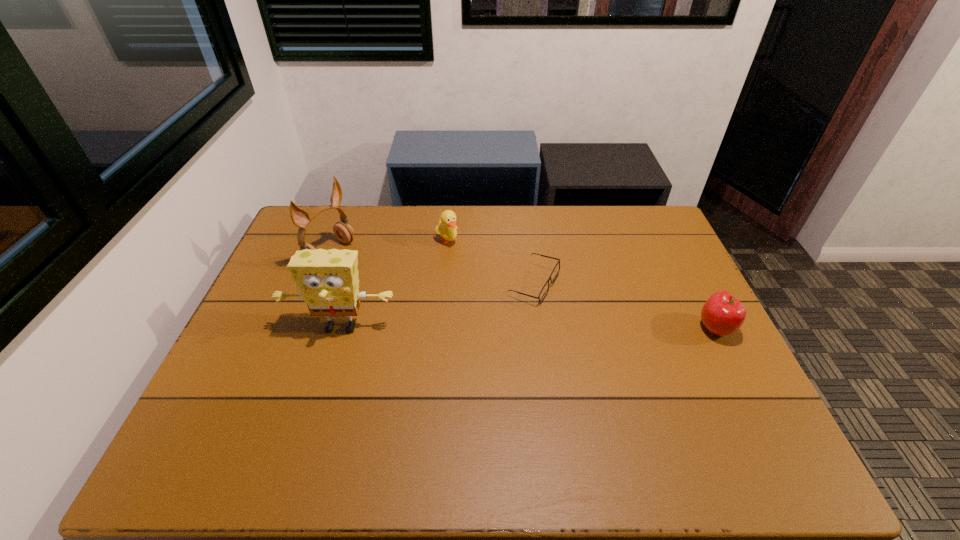
Find the location of a particular element. This screenshot has height=540, width=960. vacant space located 0.180m on the front-facing side of the third object from left to right is located at coordinates 476,282.

Locate an element on the screen. free space located on the front-facing side of the earphone is located at coordinates (399, 292).

Find the location of a particular element. Image resolution: width=960 pixels, height=540 pixels. vacant point located on the front-facing side of the earphone is located at coordinates [399, 292].

Where is `free region located 0.190m on the front-facing side of the earphone`? This screenshot has height=540, width=960. free region located 0.190m on the front-facing side of the earphone is located at coordinates (390, 286).

The height and width of the screenshot is (540, 960). I want to click on free space located with the lenses facing outward on the fourth object from left to right, so click(586, 334).

You are a GUI agent. You are given a task and a screenshot of the screen. Output one action in this format:
    pyautogui.click(x=<x>, y=<y>)
    Task: Click on the free space located 0.240m with the lenses facing outward on the fourth object from left to right
    The height and width of the screenshot is (540, 960).
    Given the screenshot: What is the action you would take?
    pyautogui.click(x=612, y=359)

I want to click on vacant space located with the lenses facing outward on the fourth object from left to right, so click(x=599, y=346).

The height and width of the screenshot is (540, 960). Identify the location of duckling that is at the far edge. click(x=446, y=227).

Locate an element on the screen. The height and width of the screenshot is (540, 960). earphone located at the far edge is located at coordinates (343, 231).

The image size is (960, 540). What are the coordinates of `sponge that is positioned at the left edge` in the screenshot? It's located at (328, 282).